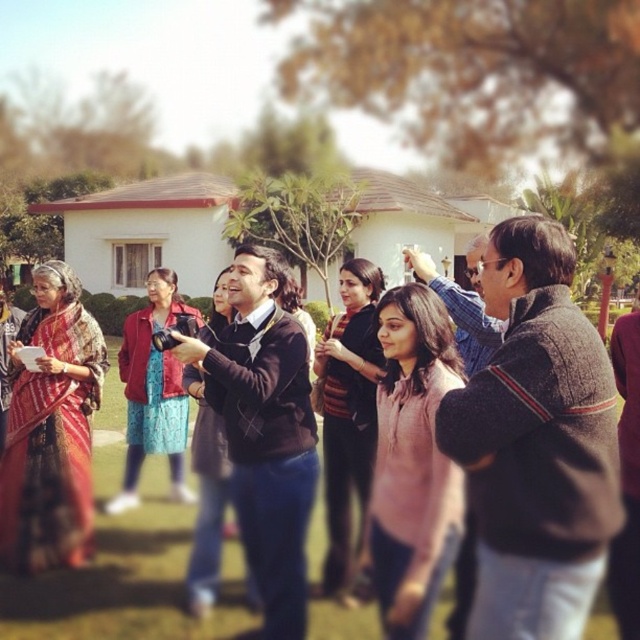
Where is the dark brown woolen sweater at center located in the image?

The dark brown woolen sweater at center is located at the point with coordinates 0.692 and 0.839 in the image.